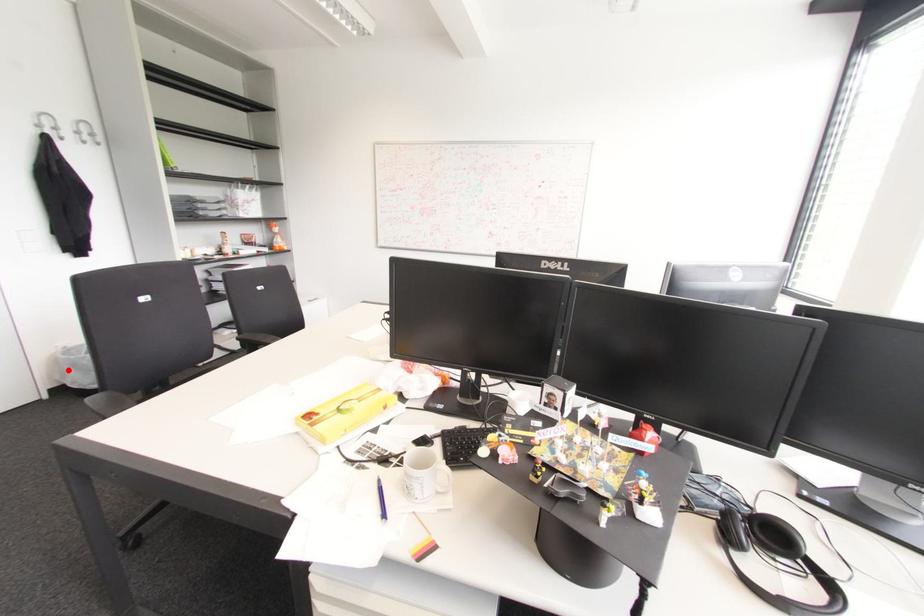
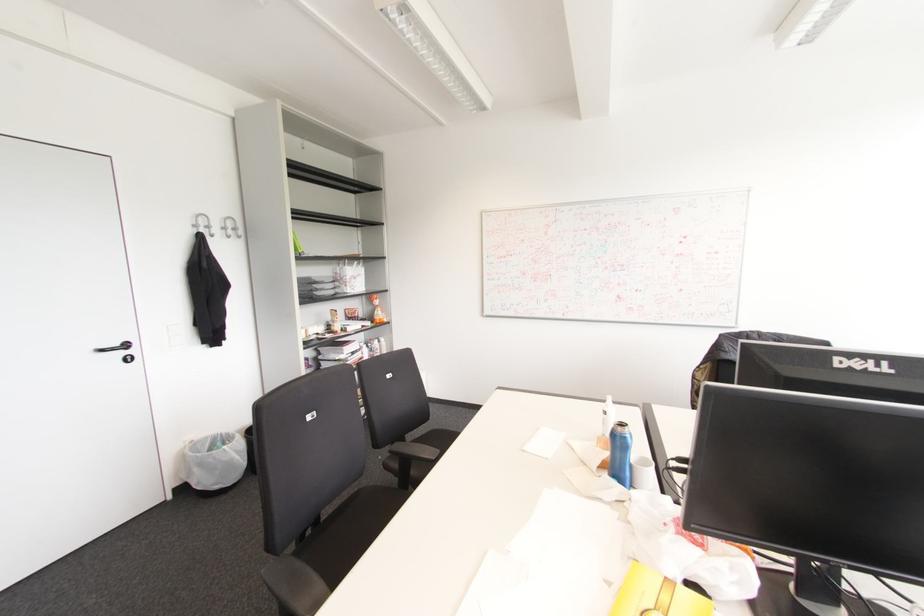
Question: I am providing you with two images of the same scene from different viewpoints. A red point is shown in image1. For the corresponding object point in image2, is it positioned nearer or farther from the camera?

Choices:
 (A) Nearer
 (B) Farther

Answer: (B)